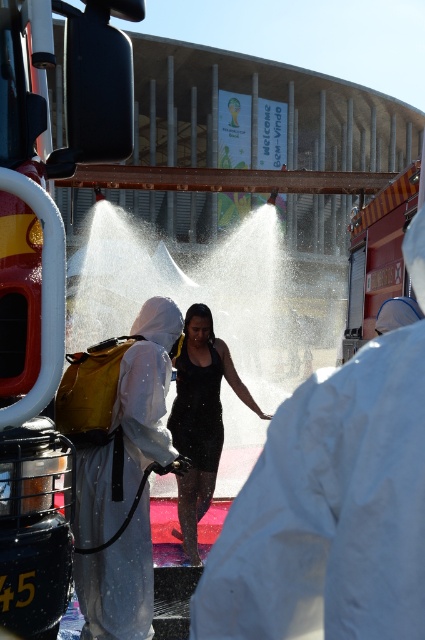
You are a photographer standing at the edge of the event area. You need to capture a photo that includes both the white protective suit at center and the black matte dress at center. Given that your camera has a maximum focus range of 5 feet, will you be able to include both subjects in the same frame without moving closer?

The white protective suit at center is 5.78 feet away from the black matte dress at center. Since the distance between them exceeds the camera maximum focus range of 5 feet, you will not be able to include both subjects in the same frame without moving closer.

You are a photographer positioned at the center of the scene. You need to capture a photo that includes both the yellow metallic fire truck at left and the two individuals in white protective suits. Based on their positions, will the fire truck be to the left or right of the individuals in the photo?

The yellow metallic fire truck at left is located at point (53, 176), so in the photo, the fire truck will be to the left of the individuals in white protective suits.

You are standing at the point labeled as point (x=53, y=176) in the image. What object are you currently standing on?

The point labeled as point (x=53, y=176) is on the yellow metallic fire truck at left.